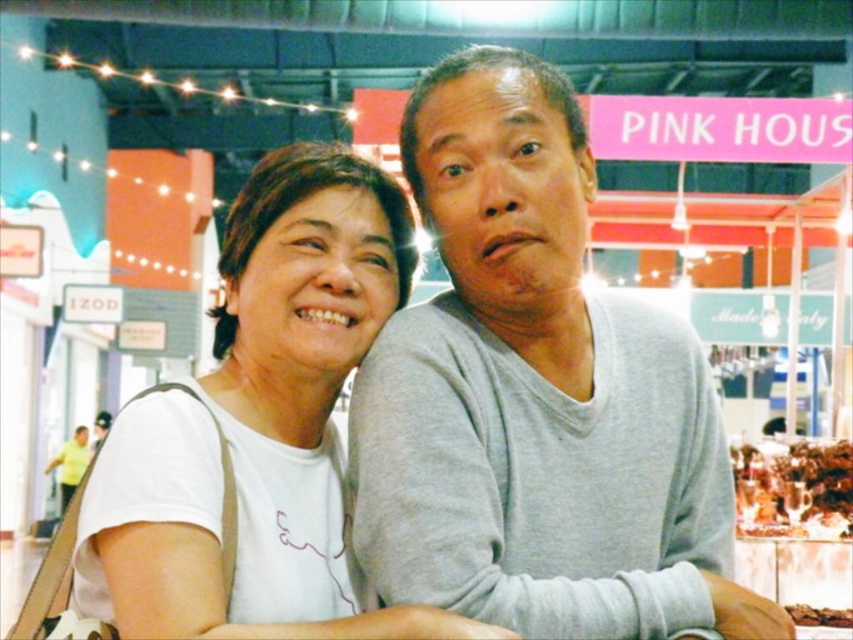
What is the location of the point with coordinates (537, 396) in the image?

The point with coordinates (537, 396) is located on the gray matte sweater at center.

You are standing in the market and want to move from the point closer to you to the point further away. Which path should you take? The path goes through the two points labeled as point [355,272] and point [827,468]. Which point is closer to you?

Point [355,272] is closer to the viewer than point [827,468], so you should start at point [355,272] and move towards point [827,468].

You are a photographer trying to capture the gray matte sweater at center and the brown matte food at center in a single shot. Can you see both items clearly in your camera frame without moving the camera?

The gray matte sweater at center is positioned over the brown matte food at center, so the sweater is covering part of the food. You might not be able to see the entire brown matte food at center clearly in the frame.